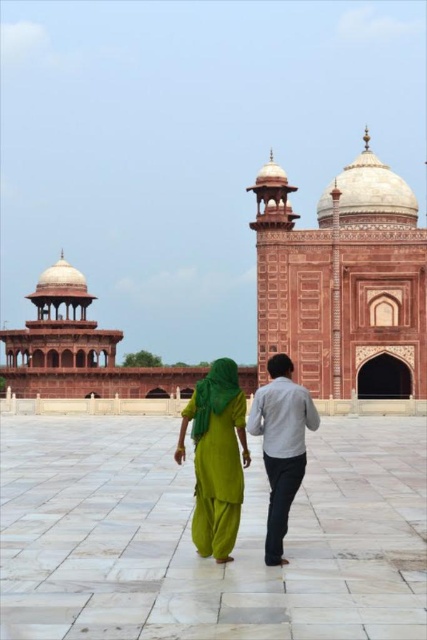
You are standing at the entrance of the historical site and see the point marked at coordinates point (x=344, y=282). What architectural feature is this point located on?

The point (x=344, y=282) is located on the marble dome at center.

You are an architect visiting this historical site. You need to determine which object occupies a larger horizontal space between the marble dome at center and the green fabric dress at center. Which one is wider?

The marble dome at center is wider than the green fabric dress at center according to the description provided.

You are a visitor at this historical site and want to take a photo of both the marble dome at center and the green fabric dress at center. Since you have a camera with a fixed focal length, you need to ensure both are in the same frame. Given their heights, which object should you focus on to include both in the photo?

Since the marble dome at center is taller than the green fabric dress at center, you should focus on the marble dome at center to ensure both are in the frame as it requires a wider angle to capture its height, which would naturally include the shorter green fabric dress at center.